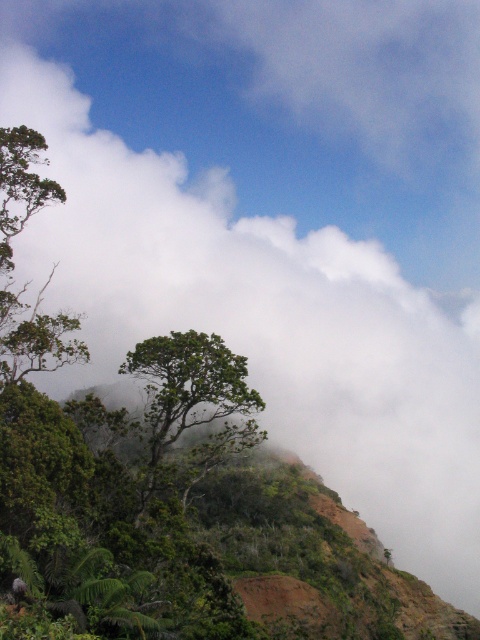
You are a hiker trying to navigate through the forest depicted in the image. You notice two trees ahead of you, the green leafy tree at left and the green leafy tree at center. Which tree should you choose to walk around if you want to take the wider path between them?

You should choose to walk around the green leafy tree at left because its width is larger than the green leafy tree at center, providing a wider path between them.

You are standing at the point marked by the coordinates point (13, 266) in the image. What is the nearest object to you?

The point (13, 266) marks the green leafy tree at left, so the nearest object to you is the green leafy tree at left.